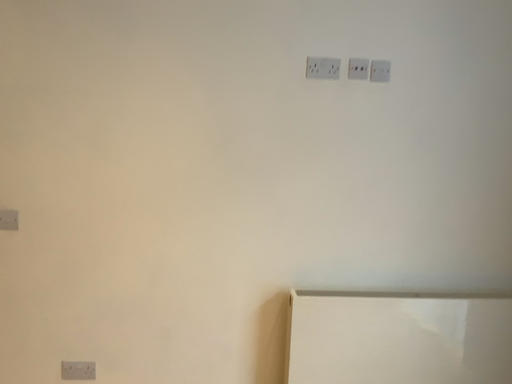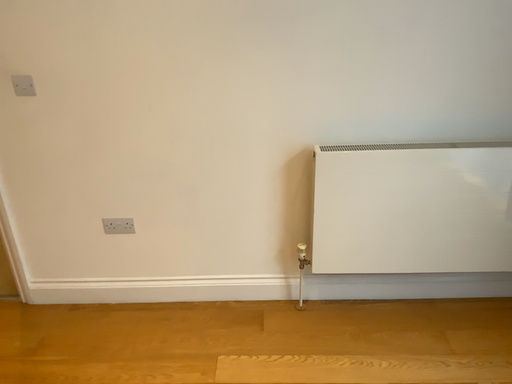
Question: Which way did the camera rotate in the video?

Choices:
 (A) rotated right
 (B) rotated left

Answer: (B)